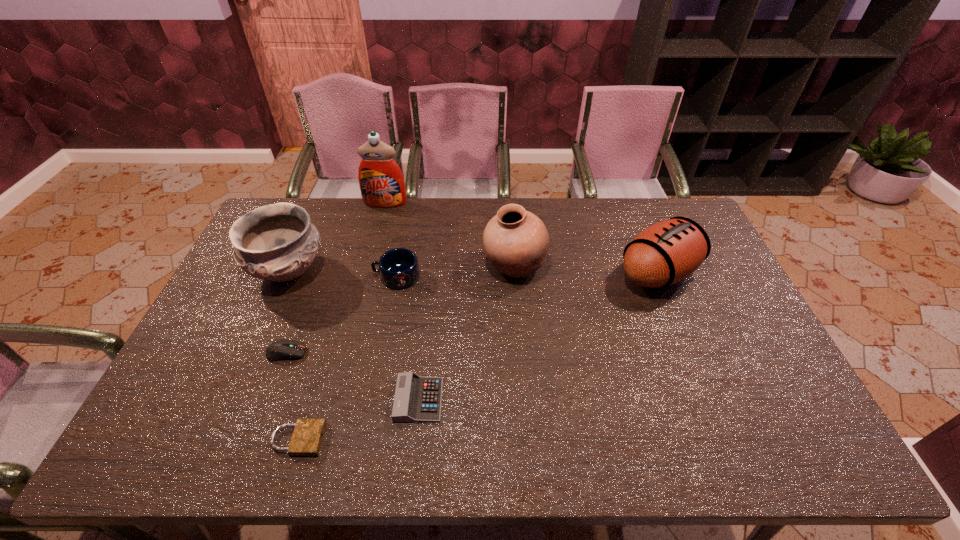
Locate an element on the screen. free space located 0.230m on the front surface of the farthest object is located at coordinates (373, 249).

Locate an element on the screen. vacant space located 0.320m on the right of the right pottery is located at coordinates (643, 266).

Locate an element on the screen. The width and height of the screenshot is (960, 540). vacant area situated on the front of the left pottery is located at coordinates (260, 336).

I want to click on free space located on the left of the rightmost object, so click(x=550, y=273).

Image resolution: width=960 pixels, height=540 pixels. I want to click on free spot located with the handle on the side of the mug, so click(x=302, y=276).

Locate an element on the screen. The height and width of the screenshot is (540, 960). vacant space located with the handle on the side of the mug is located at coordinates (281, 276).

The height and width of the screenshot is (540, 960). In order to click on free region located 0.340m with the handle on the side of the mug in this screenshot , I will do `click(269, 276)`.

The image size is (960, 540). Identify the location of free point located on the button of the third nearest object. (353, 353).

You are a GUI agent. You are given a task and a screenshot of the screen. Output one action in this format:
    pyautogui.click(x=<x>, y=<y>)
    Task: Click on the vacant space located 0.070m on the back of the calculator
    This screenshot has width=960, height=540.
    Given the screenshot: What is the action you would take?
    pyautogui.click(x=423, y=357)

I want to click on vacant space situated on the keyhole side of the padlock, so click(408, 439).